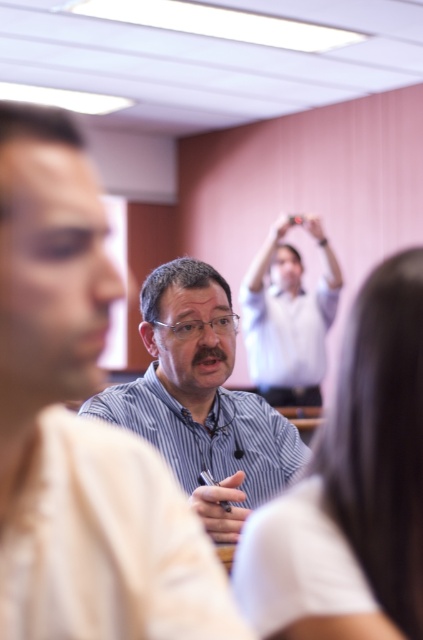
Question: Can you confirm if matte black pen at center is positioned to the right of matte black hand at upper center?

Choices:
 (A) no
 (B) yes

Answer: (A)

Question: Which point is farther to the camera?

Choices:
 (A) (280, 385)
 (B) (202, 349)
 (C) (206, 509)

Answer: (A)

Question: Which of the following is the closest to the observer?

Choices:
 (A) (316, 234)
 (B) (277, 236)
 (C) (187, 381)
 (D) (290, 336)

Answer: (C)

Question: Which point is farther to the camera?

Choices:
 (A) white matte hand at upper center
 (B) striped shirt at center
 (C) light blue striped shirt at center

Answer: (C)

Question: From the image, what is the correct spatial relationship of light blue striped shirt at center in relation to white matte hand at upper center?

Choices:
 (A) above
 (B) below

Answer: (B)

Question: Is striped shirt at center bigger than light blue striped shirt at center?

Choices:
 (A) no
 (B) yes

Answer: (A)